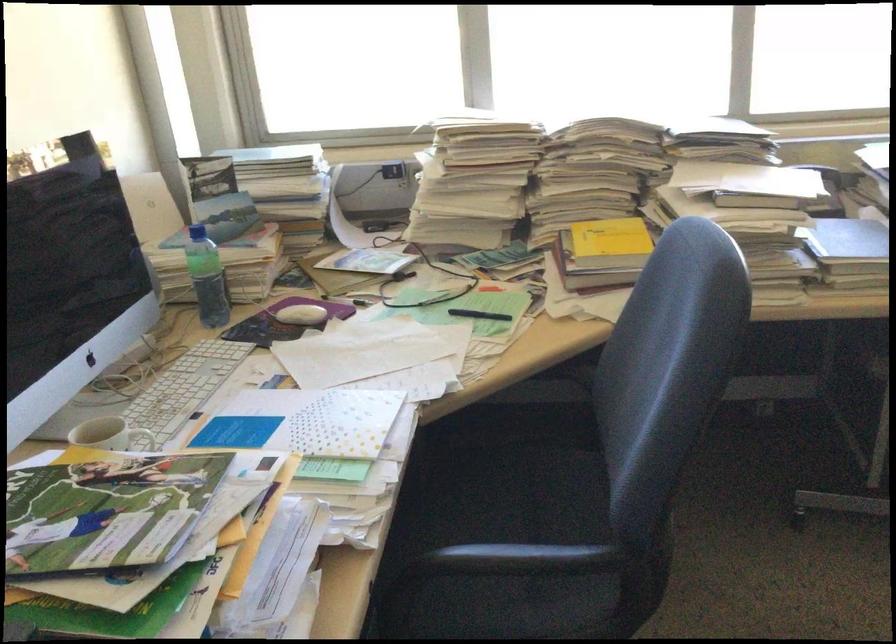
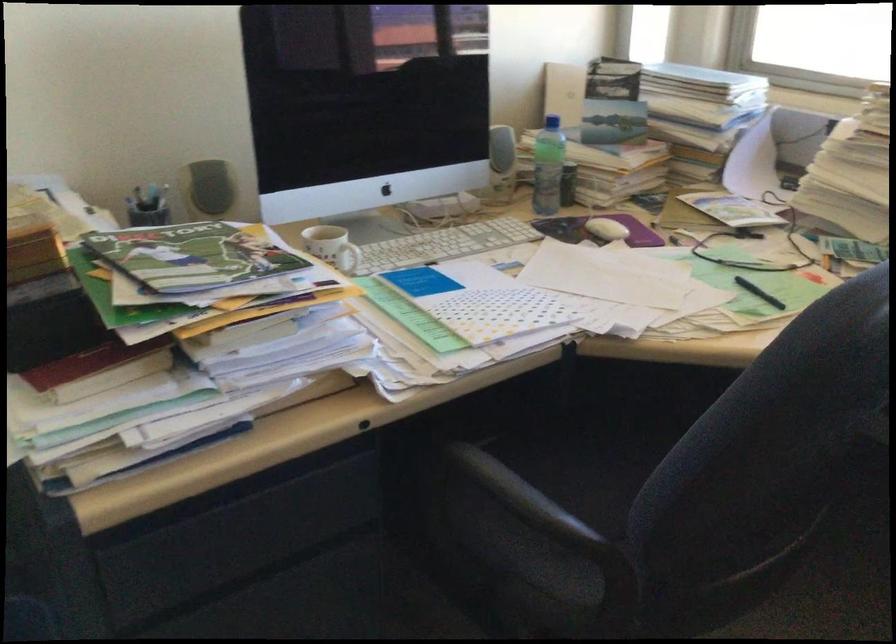
The point at (566, 556) is marked in the first image. Where is the corresponding point in the second image?

(532, 506)